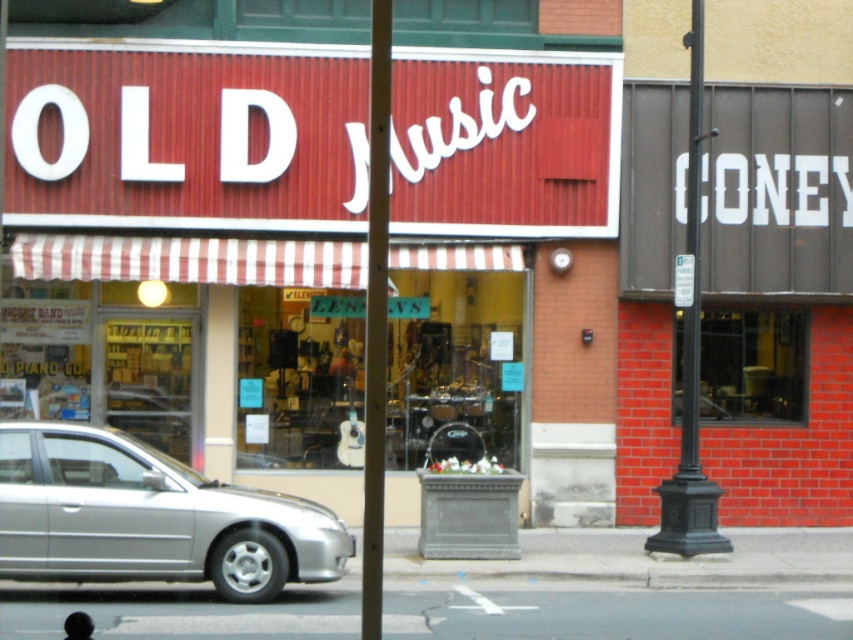
Question: Can you confirm if smooth wooden pole at center is positioned above black metal pole at right?

Choices:
 (A) no
 (B) yes

Answer: (B)

Question: Is smooth wooden pole at center thinner than black metal pole at right?

Choices:
 (A) yes
 (B) no

Answer: (B)

Question: Can you confirm if silver metallic car at lower left is positioned above smooth wooden pole at center?

Choices:
 (A) yes
 (B) no

Answer: (B)

Question: Which of the following is the farthest from the observer?

Choices:
 (A) (654, 545)
 (B) (364, 346)
 (C) (189, 512)

Answer: (A)

Question: Which object is the closest to the silver metallic car at lower left?

Choices:
 (A) smooth wooden pole at center
 (B) black metal pole at right

Answer: (A)

Question: Which object is positioned farthest from the smooth wooden pole at center?

Choices:
 (A) black metal pole at right
 (B) silver metallic car at lower left

Answer: (A)